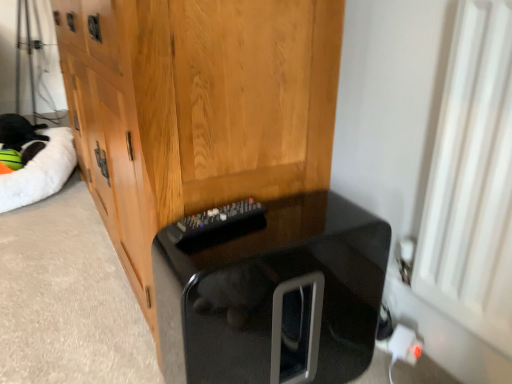
Question: Is white fluffy cat bed at left positioned behind white plastic plug at lower right?

Choices:
 (A) yes
 (B) no

Answer: (A)

Question: Considering the relative sizes of white fluffy cat bed at left and white plastic plug at lower right in the image provided, is white fluffy cat bed at left smaller than white plastic plug at lower right?

Choices:
 (A) yes
 (B) no

Answer: (B)

Question: From a real-world perspective, is white fluffy cat bed at left positioned over white plastic plug at lower right based on gravity?

Choices:
 (A) yes
 (B) no

Answer: (A)

Question: From the image's perspective, would you say white fluffy cat bed at left is shown under white plastic plug at lower right?

Choices:
 (A) yes
 (B) no

Answer: (B)

Question: Is white fluffy cat bed at left positioned beyond the bounds of white plastic plug at lower right?

Choices:
 (A) no
 (B) yes

Answer: (B)

Question: Would you say white fluffy cat bed at left is inside or outside white plastic plug at lower right?

Choices:
 (A) outside
 (B) inside

Answer: (A)

Question: Considering the positions of white fluffy cat bed at left and white plastic plug at lower right in the image, is white fluffy cat bed at left wider or thinner than white plastic plug at lower right?

Choices:
 (A) thin
 (B) wide

Answer: (B)

Question: From the image's perspective, relative to white plastic plug at lower right, is white fluffy cat bed at left above or below?

Choices:
 (A) below
 (B) above

Answer: (B)

Question: Is white fluffy cat bed at left taller or shorter than white plastic plug at lower right?

Choices:
 (A) tall
 (B) short

Answer: (A)

Question: From a real-world perspective, relative to white fluffy cat bed at left, is black glossy cat litter box at lower center vertically above or below?

Choices:
 (A) below
 (B) above

Answer: (B)

Question: Considering the positions of point (386, 226) and point (53, 170), is point (386, 226) closer or farther from the camera than point (53, 170)?

Choices:
 (A) farther
 (B) closer

Answer: (B)

Question: From the image's perspective, is black glossy cat litter box at lower center above or below white fluffy cat bed at left?

Choices:
 (A) below
 (B) above

Answer: (A)

Question: In terms of height, does black glossy cat litter box at lower center look taller or shorter compared to white fluffy cat bed at left?

Choices:
 (A) short
 (B) tall

Answer: (B)

Question: Relative to wooden cabinet at center, is white plastic plug at lower right in front or behind?

Choices:
 (A) front
 (B) behind

Answer: (B)

Question: From the image's perspective, is white plastic plug at lower right above or below wooden cabinet at center?

Choices:
 (A) below
 (B) above

Answer: (A)